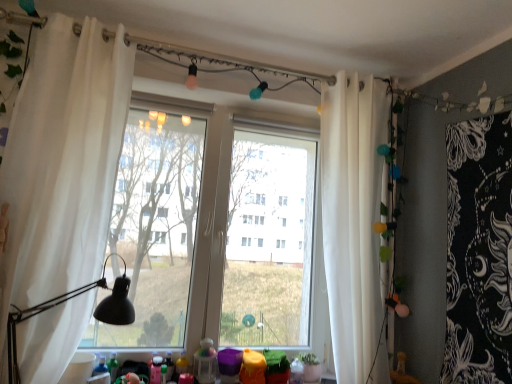
Question: Can you confirm if transparent glass window at center is taller than black matte table lamp at left?

Choices:
 (A) yes
 (B) no

Answer: (A)

Question: Are transparent glass window at center and black matte table lamp at left located far from each other?

Choices:
 (A) yes
 (B) no

Answer: (A)

Question: Does transparent glass window at center lie in front of black matte table lamp at left?

Choices:
 (A) yes
 (B) no

Answer: (B)

Question: Could you tell me if transparent glass window at center is facing black matte table lamp at left?

Choices:
 (A) yes
 (B) no

Answer: (A)

Question: Is transparent glass window at center at the right side of black matte table lamp at left?

Choices:
 (A) yes
 (B) no

Answer: (A)

Question: From the image's perspective, does transparent glass window at center appear higher than black matte table lamp at left?

Choices:
 (A) no
 (B) yes

Answer: (B)

Question: Is black matte table lamp at left to the left of translucent plastic toy at lower center from the viewer's perspective?

Choices:
 (A) yes
 (B) no

Answer: (A)

Question: Could you tell me if black matte table lamp at left is turned towards translucent plastic toy at lower center?

Choices:
 (A) no
 (B) yes

Answer: (A)

Question: Does black matte table lamp at left lie in front of translucent plastic toy at lower center?

Choices:
 (A) yes
 (B) no

Answer: (A)

Question: From the image's perspective, is black matte table lamp at left under translucent plastic toy at lower center?

Choices:
 (A) yes
 (B) no

Answer: (B)

Question: From a real-world perspective, is black matte table lamp at left over translucent plastic toy at lower center?

Choices:
 (A) yes
 (B) no

Answer: (A)

Question: Can you confirm if black matte table lamp at left is bigger than translucent plastic toy at lower center?

Choices:
 (A) no
 (B) yes

Answer: (B)

Question: Is white sheer curtain at left, the 1th curtain from the left, with white sheer curtain at right, marked as the 1th curtain in a back-to-front arrangement?

Choices:
 (A) no
 (B) yes

Answer: (A)